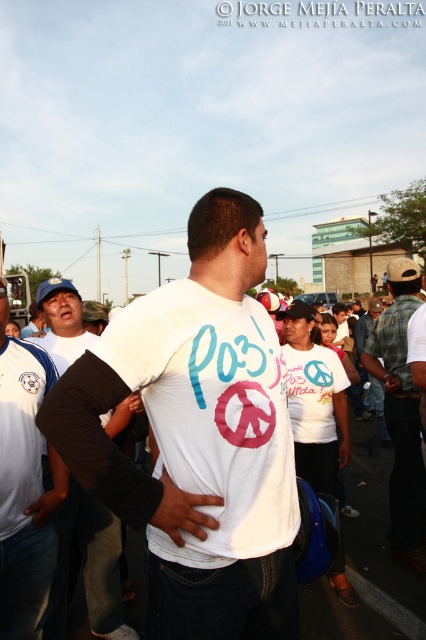
This screenshot has width=426, height=640. In order to click on black cotton shirt at left in this screenshot , I will do `click(88, 566)`.

Who is shorter, black cotton shirt at left or plaid flannel shirt at center?

Standing shorter between the two is black cotton shirt at left.

Is point (100, 541) behind point (396, 468)?

No, it is in front of (396, 468).

This screenshot has width=426, height=640. What are the coordinates of `black cotton shirt at left` in the screenshot? It's located at (88, 566).

Which is above, white matte t-shirt at center or plaid flannel shirt at center?

white matte t-shirt at center

Is white matte t-shirt at center shorter than plaid flannel shirt at center?

Correct, white matte t-shirt at center is not as tall as plaid flannel shirt at center.

The width and height of the screenshot is (426, 640). I want to click on white matte t-shirt at center, so click(198, 436).

What are the coordinates of `white matte t-shirt at center` in the screenshot? It's located at click(x=198, y=436).

In order to click on plaid flannel shirt at center in this screenshot , I will do `click(400, 413)`.

This screenshot has height=640, width=426. What do you see at coordinates (400, 413) in the screenshot? I see `plaid flannel shirt at center` at bounding box center [400, 413].

Locate an element on the screen. This screenshot has width=426, height=640. plaid flannel shirt at center is located at coordinates (400, 413).

Image resolution: width=426 pixels, height=640 pixels. In order to click on plaid flannel shirt at center in this screenshot , I will do `click(400, 413)`.